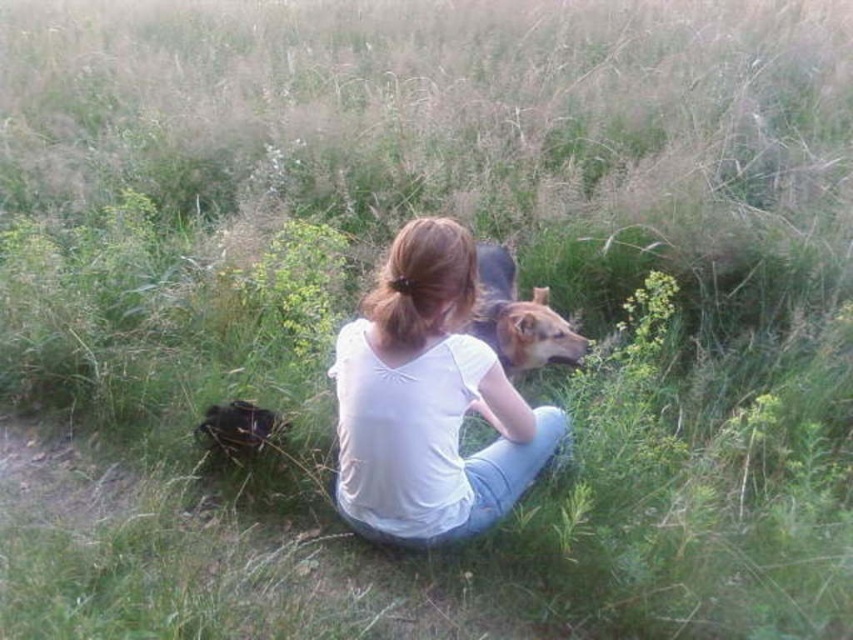
Question: Is white cotton shirt at center above brown fur dog at center?

Choices:
 (A) yes
 (B) no

Answer: (B)

Question: Among these objects, which one is farthest from the camera?

Choices:
 (A) white cotton shirt at center
 (B) brown fur dog at center

Answer: (B)

Question: Which object appears farthest from the camera in this image?

Choices:
 (A) brown fur dog at center
 (B) white cotton shirt at center

Answer: (A)

Question: Is white cotton shirt at center bigger than brown fur dog at center?

Choices:
 (A) no
 (B) yes

Answer: (B)

Question: Can you confirm if white cotton shirt at center is smaller than brown fur dog at center?

Choices:
 (A) yes
 (B) no

Answer: (B)

Question: Which point is closer to the camera?

Choices:
 (A) (578, 344)
 (B) (419, 348)

Answer: (B)